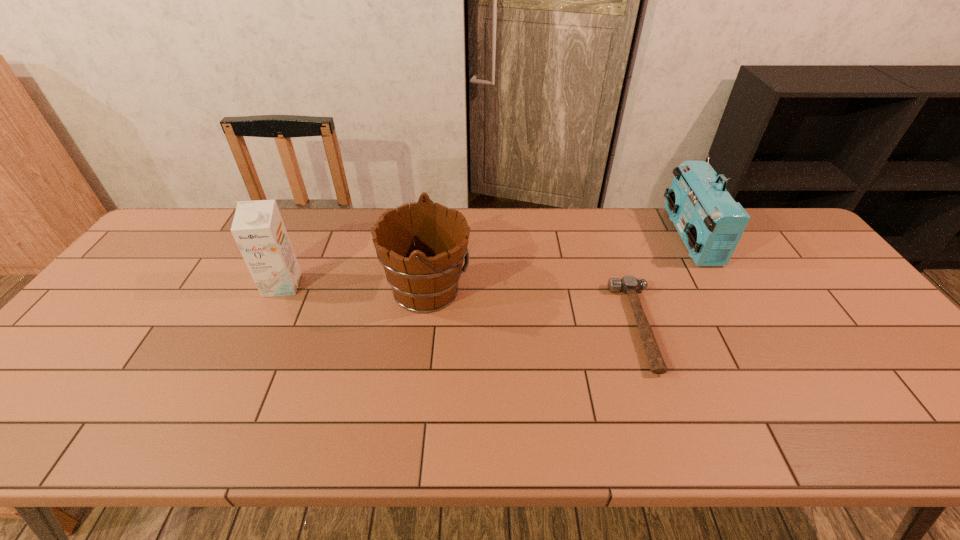
The width and height of the screenshot is (960, 540). In order to click on empty space that is in between the shortest object and the second object from left to right in this screenshot , I will do `click(533, 308)`.

Locate an element on the screen. This screenshot has width=960, height=540. unoccupied position between the hammer and the carton is located at coordinates (461, 306).

This screenshot has width=960, height=540. I want to click on vacant area that lies between the leftmost object and the shortest object, so click(461, 306).

You are a GUI agent. You are given a task and a screenshot of the screen. Output one action in this format:
    pyautogui.click(x=<x>, y=<y>)
    Task: Click on the free spot between the second object from right to left and the second object from left to right
    The width and height of the screenshot is (960, 540).
    Given the screenshot: What is the action you would take?
    pyautogui.click(x=533, y=308)

Image resolution: width=960 pixels, height=540 pixels. Find the location of `empty space that is in between the hammer and the rightmost object`. empty space that is in between the hammer and the rightmost object is located at coordinates (664, 281).

Image resolution: width=960 pixels, height=540 pixels. In order to click on vacant region between the leftmost object and the radio receiver in this screenshot , I will do `click(486, 261)`.

At what (x,y) coordinates should I click in order to perform the action: click on free space between the rightmost object and the leftmost object. Please return your answer as a coordinate pair (x, y). Image resolution: width=960 pixels, height=540 pixels. Looking at the image, I should click on (486, 261).

You are a GUI agent. You are given a task and a screenshot of the screen. Output one action in this format:
    pyautogui.click(x=<x>, y=<y>)
    Task: Click on the free area in between the leftmost object and the wine bucket
    
    Given the screenshot: What is the action you would take?
    pyautogui.click(x=355, y=288)

You are a GUI agent. You are given a task and a screenshot of the screen. Output one action in this format:
    pyautogui.click(x=<x>, y=<y>)
    Task: Click on the unoccupied area between the leftmost object and the wine bucket
    The image size is (960, 540).
    Given the screenshot: What is the action you would take?
    pyautogui.click(x=355, y=288)

This screenshot has width=960, height=540. What are the coordinates of `object that stands as the closest to the third object from left to right` in the screenshot? It's located at (710, 222).